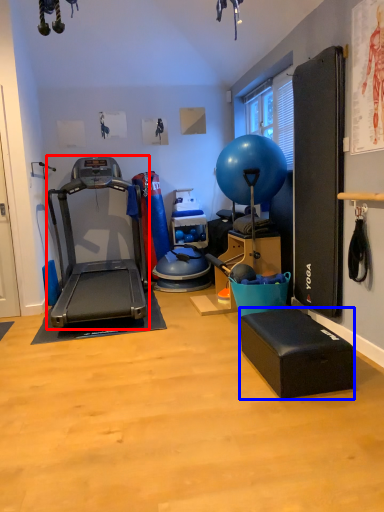
Question: Which object is closer to the camera taking this photo, treadmill (highlighted by a red box) or footrest (highlighted by a blue box)?

Choices:
 (A) treadmill
 (B) footrest

Answer: (B)